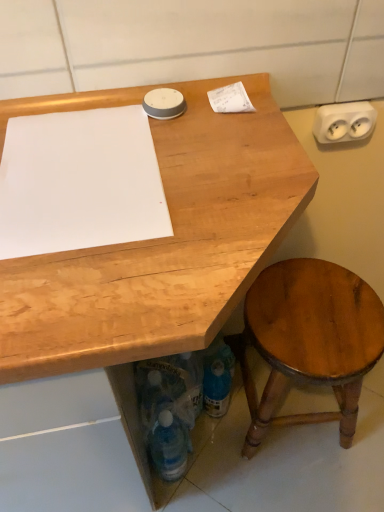
Question: Should I look upward or downward to see white plastic electrical outlet at upper right?

Choices:
 (A) up
 (B) down

Answer: (A)

Question: From the image's perspective, would you say white plastic electrical outlet at upper right is shown under shiny brown wood stool at lower right?

Choices:
 (A) no
 (B) yes

Answer: (A)

Question: Can you confirm if white plastic electrical outlet at upper right is shorter than shiny brown wood stool at lower right?

Choices:
 (A) no
 (B) yes

Answer: (B)

Question: Is shiny brown wood stool at lower right surrounded by white plastic electrical outlet at upper right?

Choices:
 (A) no
 (B) yes

Answer: (A)

Question: Is white plastic electrical outlet at upper right thinner than shiny brown wood stool at lower right?

Choices:
 (A) no
 (B) yes

Answer: (B)

Question: Can you confirm if white plastic electrical outlet at upper right is bigger than shiny brown wood stool at lower right?

Choices:
 (A) no
 (B) yes

Answer: (A)

Question: Is white plastic electrical outlet at upper right oriented away from shiny brown wood stool at lower right?

Choices:
 (A) no
 (B) yes

Answer: (A)

Question: Can you confirm if translucent plastic bottle at lower center, which is the 1th bottle from left to right, is bigger than white plastic electrical outlet at upper right?

Choices:
 (A) yes
 (B) no

Answer: (A)

Question: Does translucent plastic bottle at lower center, the 2th bottle positioned from the right, appear on the left side of white plastic electrical outlet at upper right?

Choices:
 (A) yes
 (B) no

Answer: (A)

Question: Does translucent plastic bottle at lower center, the 2th bottle positioned from the right, come behind white plastic electrical outlet at upper right?

Choices:
 (A) no
 (B) yes

Answer: (B)

Question: Does translucent plastic bottle at lower center, the 2th bottle positioned from the right, have a lesser width compared to white plastic electrical outlet at upper right?

Choices:
 (A) yes
 (B) no

Answer: (B)

Question: Considering the relative sizes of translucent plastic bottle at lower center, which is the 1th bottle from left to right, and white plastic electrical outlet at upper right in the image provided, is translucent plastic bottle at lower center, which is the 1th bottle from left to right, shorter than white plastic electrical outlet at upper right?

Choices:
 (A) yes
 (B) no

Answer: (B)

Question: From the image's perspective, is translucent plastic bottle at lower center, the 2th bottle positioned from the right, located beneath white plastic electrical outlet at upper right?

Choices:
 (A) no
 (B) yes

Answer: (B)

Question: Is white paper at upper right, the first notepad in the right-to-left sequence, positioned beyond the bounds of white plastic electrical outlet at upper right?

Choices:
 (A) yes
 (B) no

Answer: (A)